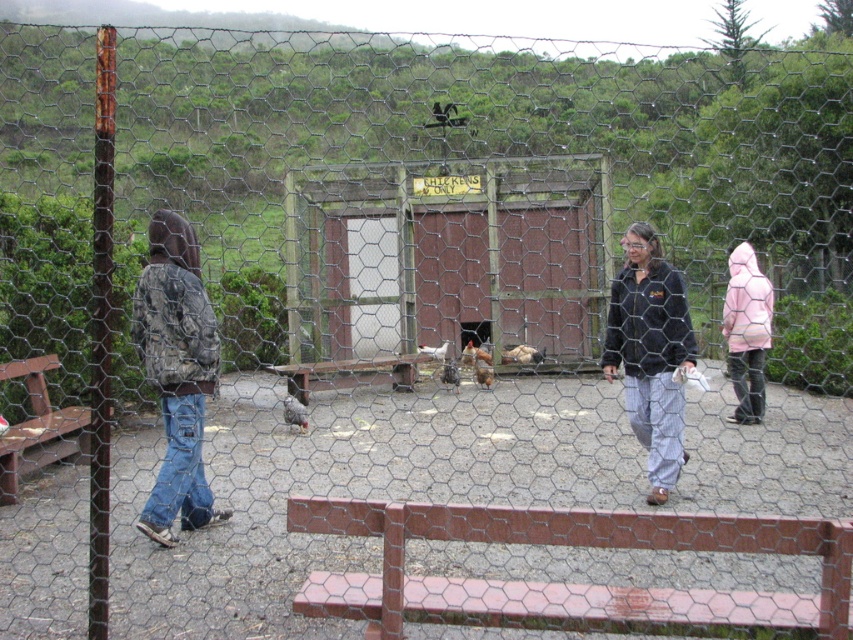
Does black textured jacket at center have a larger size compared to wooden bench at left?

Incorrect, black textured jacket at center is not larger than wooden bench at left.

Can you confirm if black textured jacket at center is positioned to the right of wooden bench at left?

Yes, black textured jacket at center is to the right of wooden bench at left.

Between point (679, 358) and point (20, 371), which one is positioned behind?

The point (20, 371) is behind.

In order to click on black textured jacket at center in this screenshot , I will do `click(650, 353)`.

Is black textured jacket at center above gray fur cat at center?

Indeed, black textured jacket at center is positioned over gray fur cat at center.

Which is in front, point (672, 330) or point (291, 394)?

Point (672, 330) is more forward.

The height and width of the screenshot is (640, 853). Find the location of `black textured jacket at center`. black textured jacket at center is located at coordinates (650, 353).

Is camouflage jacket at left wider than gray fur cat at center?

Answer: Indeed, camouflage jacket at left has a greater width compared to gray fur cat at center.

Who is higher up, camouflage jacket at left or gray fur cat at center?

camouflage jacket at left is above.

Is point (178, 394) positioned behind point (305, 410)?

No, it is not.

I want to click on camouflage jacket at left, so click(x=177, y=372).